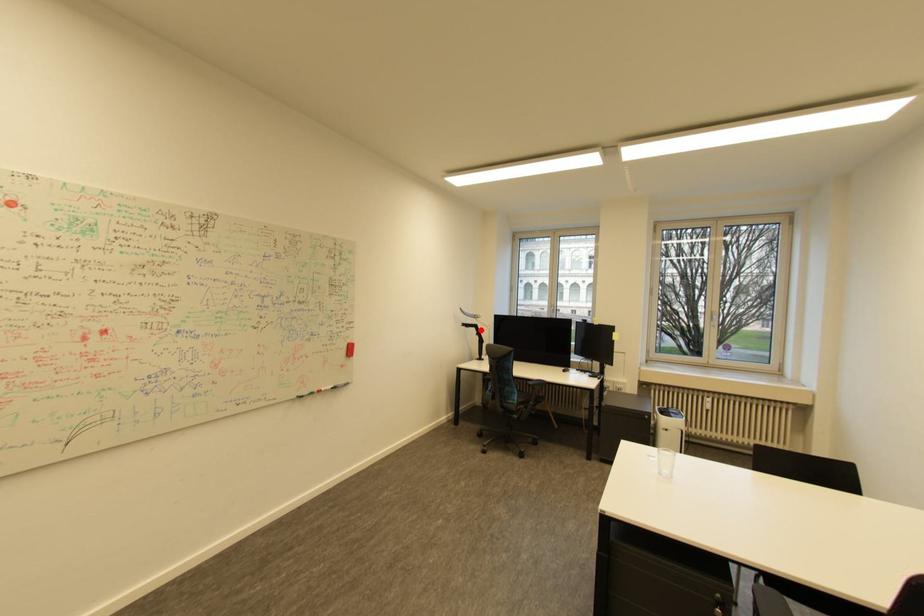
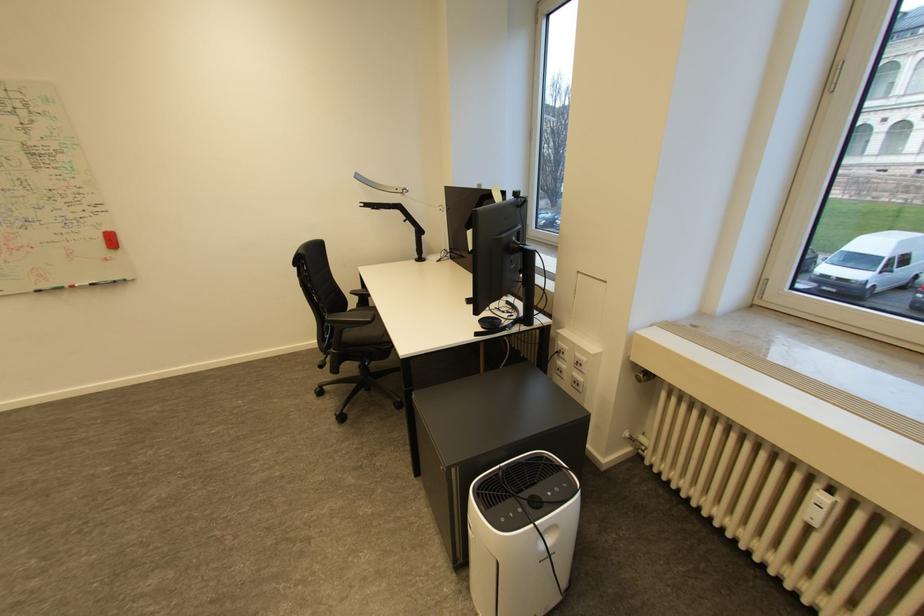
Question: I am providing you with two images of the same scene from different viewpoints. A red point is shown in image1. For the corresponding object point in image2, is it positioned nearer or farther from the camera?

Choices:
 (A) Nearer
 (B) Farther

Answer: (A)